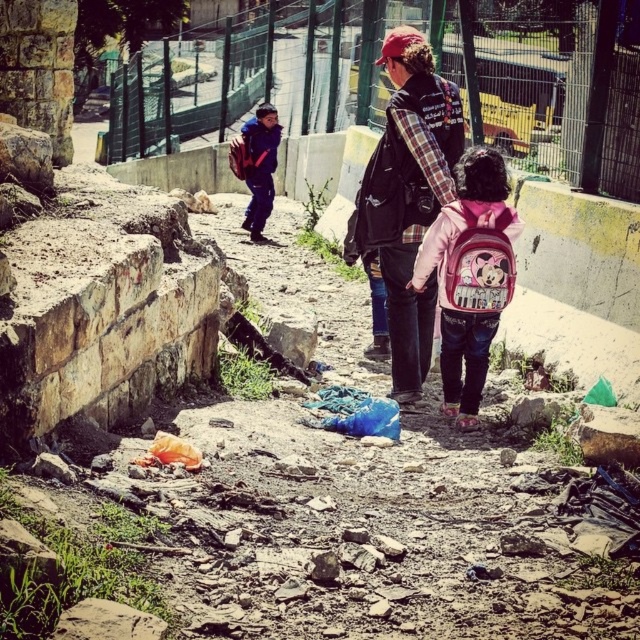
Between point (500, 289) and point (397, 224), which one is positioned in front?

Point (500, 289)

Which is behind, point (497, 285) or point (451, 125)?

The point (451, 125) is more distant.

This screenshot has height=640, width=640. Describe the element at coordinates (470, 275) in the screenshot. I see `pink fabric backpack at center` at that location.

You are a GUI agent. You are given a task and a screenshot of the screen. Output one action in this format:
    pyautogui.click(x=<x>, y=<y>)
    Task: Click on the pink fabric backpack at center
    
    Given the screenshot: What is the action you would take?
    pyautogui.click(x=470, y=275)

Between point (266, 134) and point (244, 140), which one is positioned behind?

The point (266, 134) is more distant.

Does blue matte backpack at upper center lie behind matte purple backpack at upper left?

No, blue matte backpack at upper center is closer to the viewer.

At what (x,y) coordinates should I click in order to perform the action: click on blue matte backpack at upper center. Please return your answer as a coordinate pair (x, y). Looking at the image, I should click on (259, 166).

Is point (378, 157) positioned behind point (243, 172)?

No, (378, 157) is in front of (243, 172).

Which of these two, plaid fabric shirt at center or matte purple backpack at upper left, stands shorter?

Standing shorter between the two is matte purple backpack at upper left.

Find the location of a particular element. Image resolution: width=640 pixels, height=640 pixels. plaid fabric shirt at center is located at coordinates (410, 195).